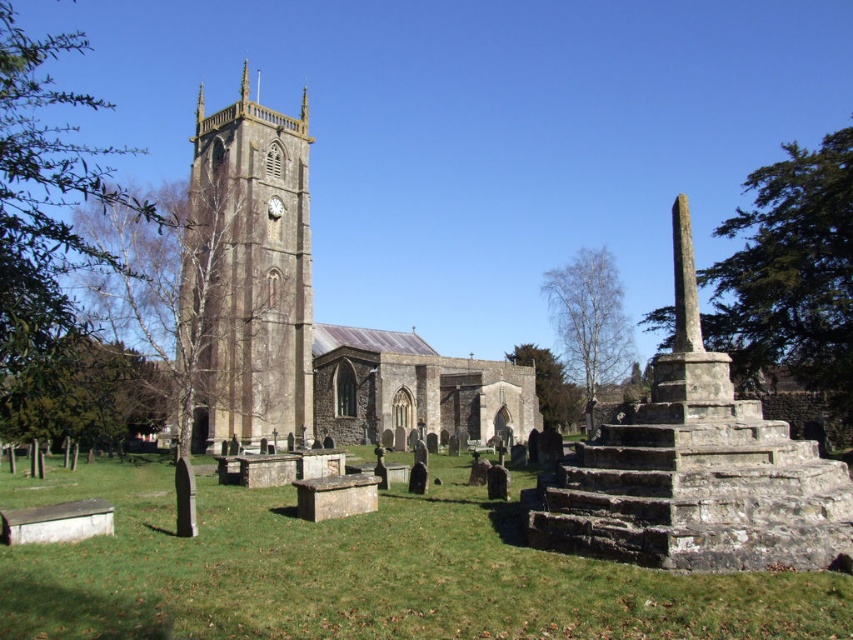
You are standing in front of the historic church and want to take a photo. There are two points marked in the scene, point 1 at coordinates point [74,596] and point 2 at coordinates point [207,173]. Which point is closer to your current position?

Point [74,596] is closer to the camera than point [207,173], so point 1 is closer to your current position.

You are standing in the middle of the graveyard and want to visit the stone church at center and the stone clock tower at left. Which one is closer to your current position?

The stone clock tower at left is closer to your current position because the distance between the stone church at center and the stone clock tower at left is 16.48 feet, so the stone clock tower at left is closer to the middle of the graveyard than the stone church at center.